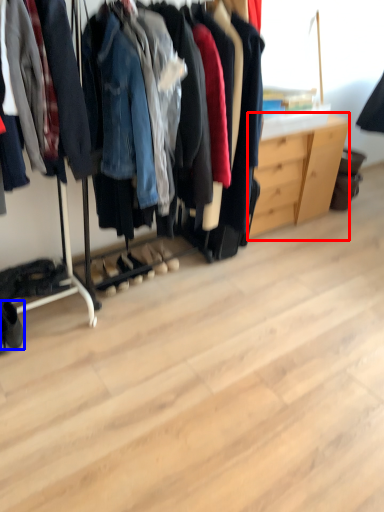
Question: Which point is closer to the camera, dresser (highlighted by a red box) or footwear (highlighted by a blue box)?

Choices:
 (A) dresser
 (B) footwear

Answer: (B)